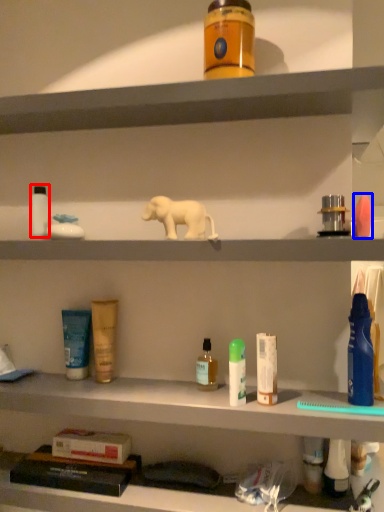
Question: Among these objects, which one is farthest to the camera, toiletry (highlighted by a red box) or toiletry (highlighted by a blue box)?

Choices:
 (A) toiletry
 (B) toiletry

Answer: (A)